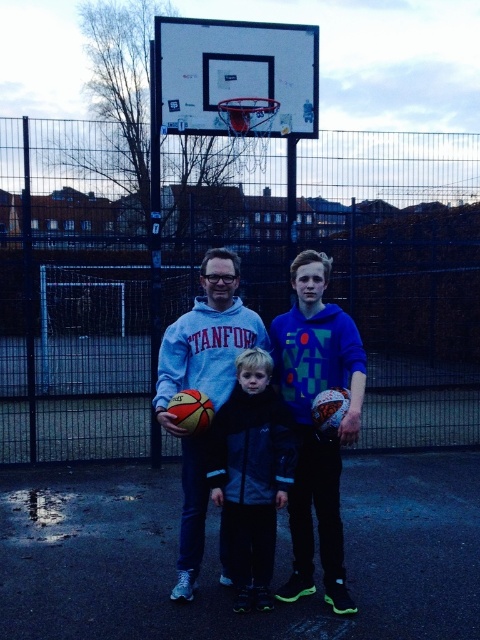
Question: Which of these objects is positioned closest to the blue fleece hoodie at center?

Choices:
 (A) black matte jacket at center
 (B) matte blue hoodie at center

Answer: (A)

Question: Estimate the real-world distances between objects in this image. Which object is farther from the black matte jacket at center?

Choices:
 (A) blue fleece hoodie at center
 (B) matte blue hoodie at center

Answer: (B)

Question: Considering the relative positions of blue fleece hoodie at center and matte blue hoodie at center in the image provided, where is blue fleece hoodie at center located with respect to matte blue hoodie at center?

Choices:
 (A) right
 (B) left

Answer: (A)

Question: Based on their relative distances, which object is nearer to the blue fleece hoodie at center?

Choices:
 (A) black matte jacket at center
 (B) matte blue hoodie at center

Answer: (A)

Question: Does blue fleece hoodie at center have a lesser width compared to matte blue hoodie at center?

Choices:
 (A) yes
 (B) no

Answer: (A)

Question: Is black matte jacket at center smaller than matte blue hoodie at center?

Choices:
 (A) no
 (B) yes

Answer: (B)